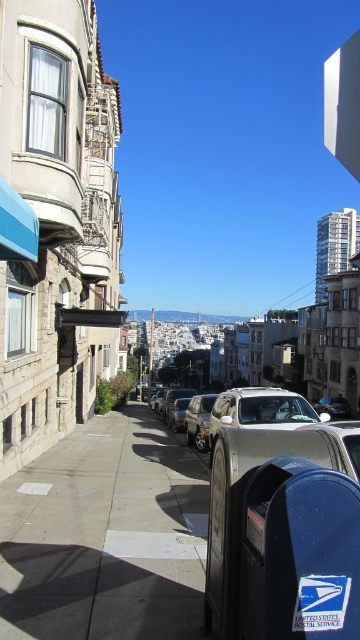
Question: Which of these objects is positioned farthest from the shiny silver sedan at center?

Choices:
 (A) gray concrete sidewalk at lower left
 (B) metallic silver car at center
 (C) satin silver suv at center
 (D) blue metallic mailbox at lower right

Answer: (B)

Question: Among these points, which one is nearest to the camera?

Choices:
 (A) (59, 490)
 (B) (192, 416)
 (C) (285, 404)

Answer: (A)

Question: Is blue metallic mailbox at lower right to the left of satin silver suv at center from the viewer's perspective?

Choices:
 (A) yes
 (B) no

Answer: (A)

Question: Is gray concrete sidewalk at lower left smaller than satin silver suv at center?

Choices:
 (A) no
 (B) yes

Answer: (B)

Question: Which point is closer to the camera?

Choices:
 (A) blue metallic mailbox at lower right
 (B) metallic silver car at center

Answer: (A)

Question: Considering the relative positions of satin silver suv at center and shiny silver sedan at center in the image provided, where is satin silver suv at center located with respect to shiny silver sedan at center?

Choices:
 (A) below
 (B) above

Answer: (B)